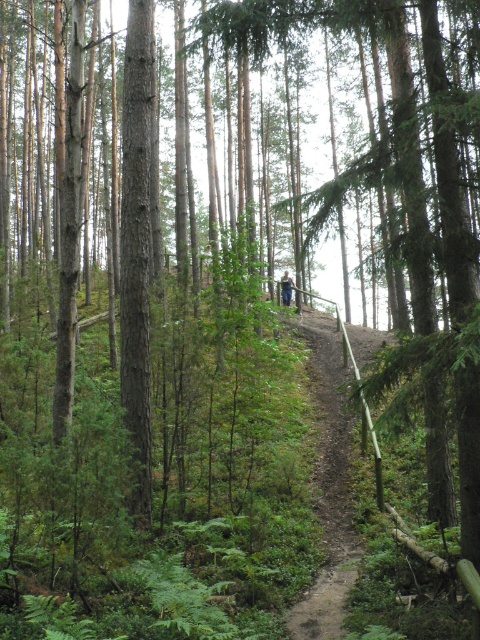
Question: Is dirt path at center behind blue jeans at center?

Choices:
 (A) yes
 (B) no

Answer: (B)

Question: Can you confirm if dirt path at center is bigger than blue jeans at center?

Choices:
 (A) no
 (B) yes

Answer: (B)

Question: Which of the following is the farthest from the observer?

Choices:
 (A) tap(334, 330)
 (B) tap(287, 288)

Answer: (B)

Question: Does dirt path at center have a lesser width compared to blue jeans at center?

Choices:
 (A) yes
 (B) no

Answer: (B)